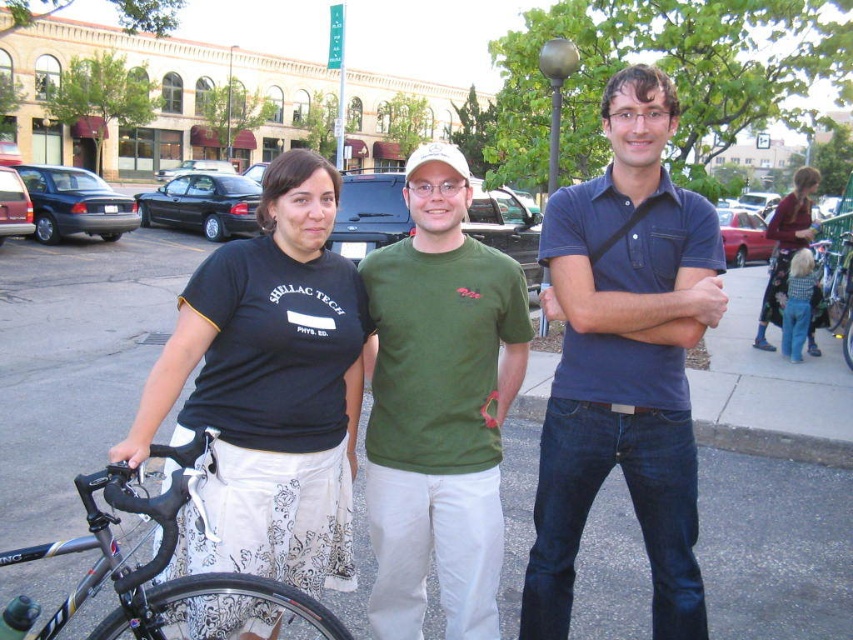
You are standing in the outdoor scene and want to take a photo of both point [805,636] and point [770,292]. Which point should you focus on first to ensure both are in focus?

You should focus on point [770,292] first because it is farther from the camera than point [805,636], ensuring both will be in focus when focusing on the farther point.

You are a delivery person who needs to place a box on the ground between the black asphalt pavement at center and the black cotton shirt at center. Which object should you place the box next to to ensure it fits properly?

The black asphalt pavement at center is wider than the black cotton shirt at center, so placing the box next to the black asphalt pavement at center ensures it will fit properly.

You are planning to place a small potted plant on the black asphalt pavement at center and the floral skirt at right. Based on their sizes, which location would be more stable for the plant?

The black asphalt pavement at center has a larger size compared to the floral skirt at right, so placing the potted plant there would provide a more stable and secure base.